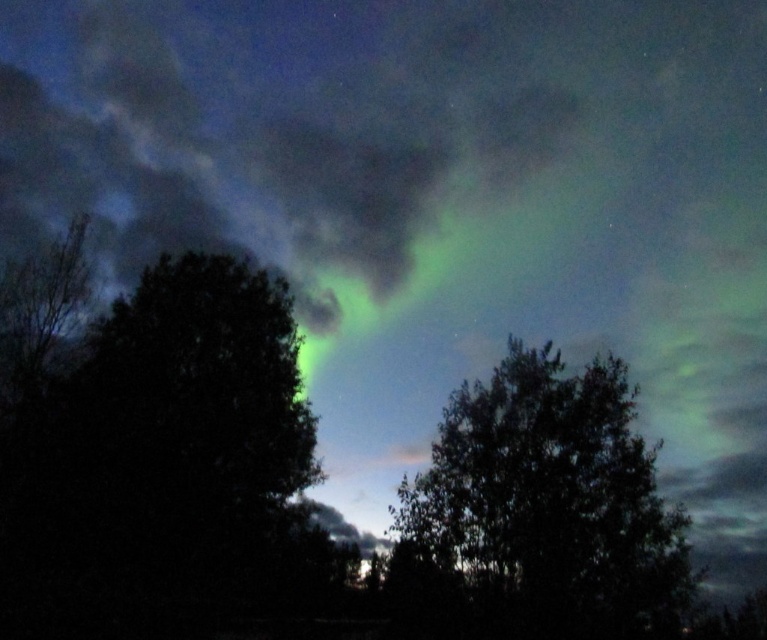
Does green leafy tree at left have a lesser height compared to green leafy tree at center?

In fact, green leafy tree at left may be taller than green leafy tree at center.

At what (x,y) coordinates should I click in order to perform the action: click on green leafy tree at left. Please return your answer as a coordinate pair (x, y). This screenshot has height=640, width=767. Looking at the image, I should click on (165, 467).

Who is more forward, (94, 634) or (570, 410)?

Point (94, 634) is more forward.

Find the location of a particular element. The width and height of the screenshot is (767, 640). green leafy tree at left is located at coordinates (165, 467).

Between green translucent aurora at upper center and green leafy tree at left, which one is positioned higher?

green translucent aurora at upper center

Does green translucent aurora at upper center appear on the right side of green leafy tree at left?

Yes, green translucent aurora at upper center is to the right of green leafy tree at left.

At what (x,y) coordinates should I click in order to perform the action: click on green translucent aurora at upper center. Please return your answer as a coordinate pair (x, y). Image resolution: width=767 pixels, height=640 pixels. Looking at the image, I should click on (268, 128).

Image resolution: width=767 pixels, height=640 pixels. Find the location of `green translucent aurora at upper center`. green translucent aurora at upper center is located at coordinates (268, 128).

At what (x,y) coordinates should I click in order to perform the action: click on green translucent aurora at upper center. Please return your answer as a coordinate pair (x, y). The height and width of the screenshot is (640, 767). Looking at the image, I should click on (268, 128).

This screenshot has width=767, height=640. Identify the location of green translucent aurora at upper center. (268, 128).